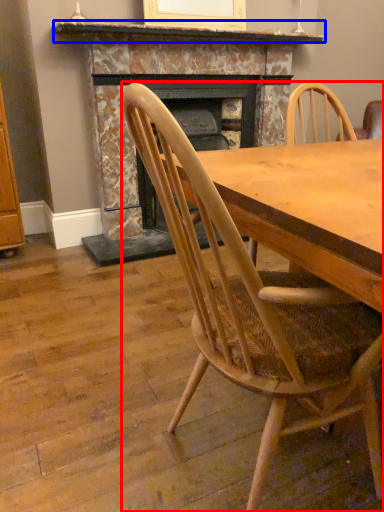
Question: Which of the following is the farthest to the observer, chair (highlighted by a red box) or mantle (highlighted by a blue box)?

Choices:
 (A) chair
 (B) mantle

Answer: (B)